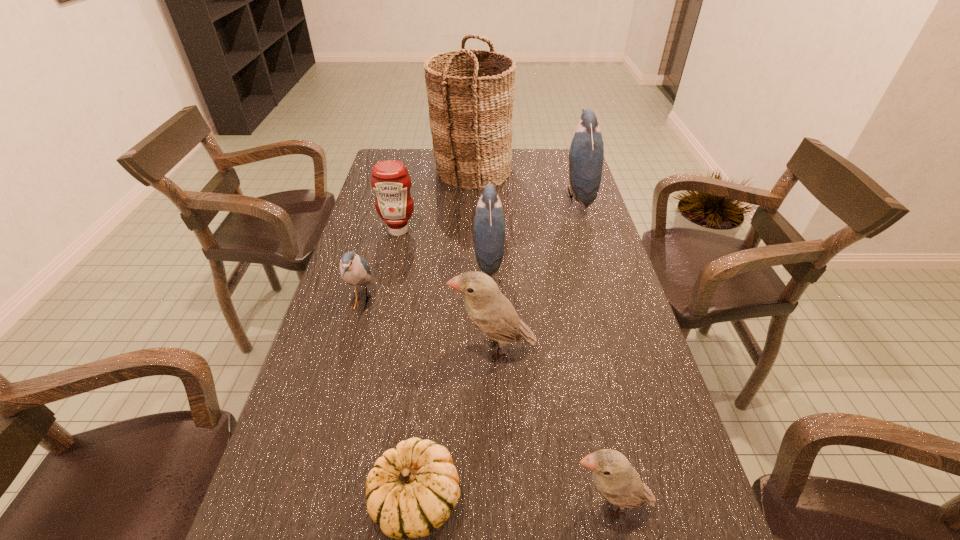
Identify the location of free space located at the face of the left white bird. (405, 348).

This screenshot has width=960, height=540. I want to click on vacant space located at the face of the left white bird, so click(x=347, y=348).

Find the location of `vacant space located 0.270m at the face of the left white bird`. vacant space located 0.270m at the face of the left white bird is located at coordinates (339, 348).

Find the location of `free space located 0.320m on the right of the sixth nearest object`. free space located 0.320m on the right of the sixth nearest object is located at coordinates (516, 231).

Identify the location of free space located at the tip of the smallest blue bird's beak. (518, 302).

Where is `vacant region located 0.400m at the face of the smaller white bird`? The image size is (960, 540). vacant region located 0.400m at the face of the smaller white bird is located at coordinates (347, 504).

Locate an element on the screen. This screenshot has height=540, width=960. free space located at the face of the smaller white bird is located at coordinates (523, 504).

Where is `free location located 0.160m at the face of the smaller white bird`? The image size is (960, 540). free location located 0.160m at the face of the smaller white bird is located at coordinates (479, 504).

Identify the location of object that is positioned at the far edge. The height and width of the screenshot is (540, 960). (470, 114).

At what (x,y) coordinates should I click in order to perform the action: click on condiment that is at the left edge. Please return your answer as a coordinate pair (x, y). This screenshot has width=960, height=540. Looking at the image, I should click on click(x=390, y=180).